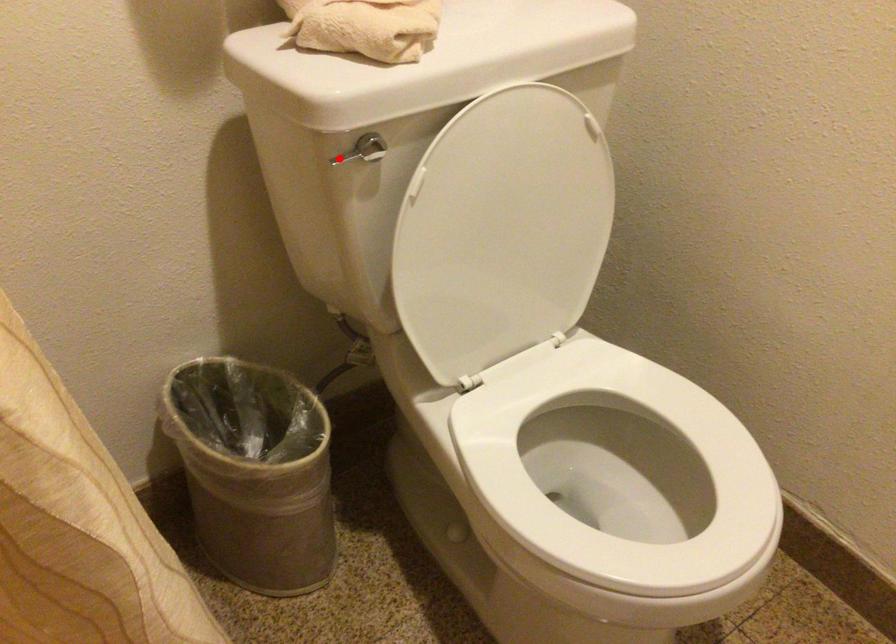
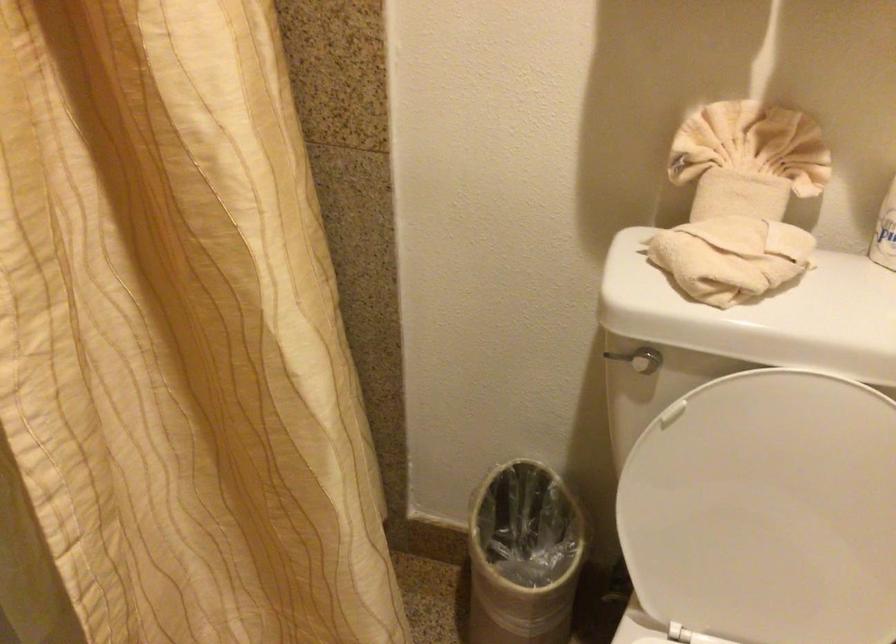
Locate, in the second image, the point that corresponds to the highlighted location in the first image.

(616, 357)